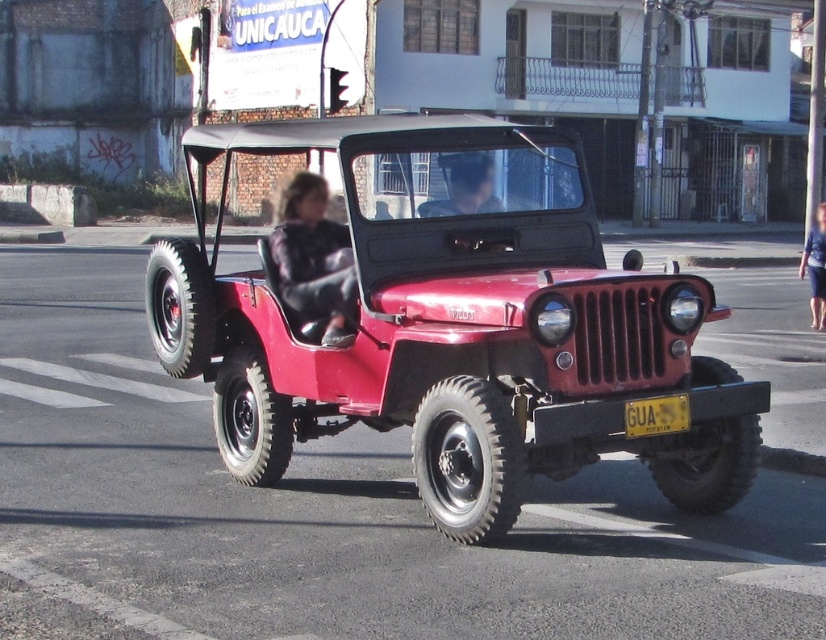
Question: Which object is farther from the camera taking this photo?

Choices:
 (A) blue fabric skirt at right
 (B) fuzzy black jacket at center
 (C) yellow metallic license plate at center

Answer: (A)

Question: Can you confirm if fuzzy black jacket at center is wider than matte black shirt at center?

Choices:
 (A) no
 (B) yes

Answer: (B)

Question: Does shiny red jeep at center appear on the left side of yellow metallic license plate at center?

Choices:
 (A) no
 (B) yes

Answer: (B)

Question: Which object appears closest to the camera in this image?

Choices:
 (A) fuzzy black jacket at center
 (B) blue fabric skirt at right
 (C) yellow metallic license plate at center

Answer: (C)

Question: Which point is farther from the camera taking this photo?

Choices:
 (A) (387, 321)
 (B) (297, 172)
 (C) (425, 205)

Answer: (B)

Question: Can you confirm if matte black shirt at center is thinner than yellow metallic license plate at center?

Choices:
 (A) yes
 (B) no

Answer: (B)